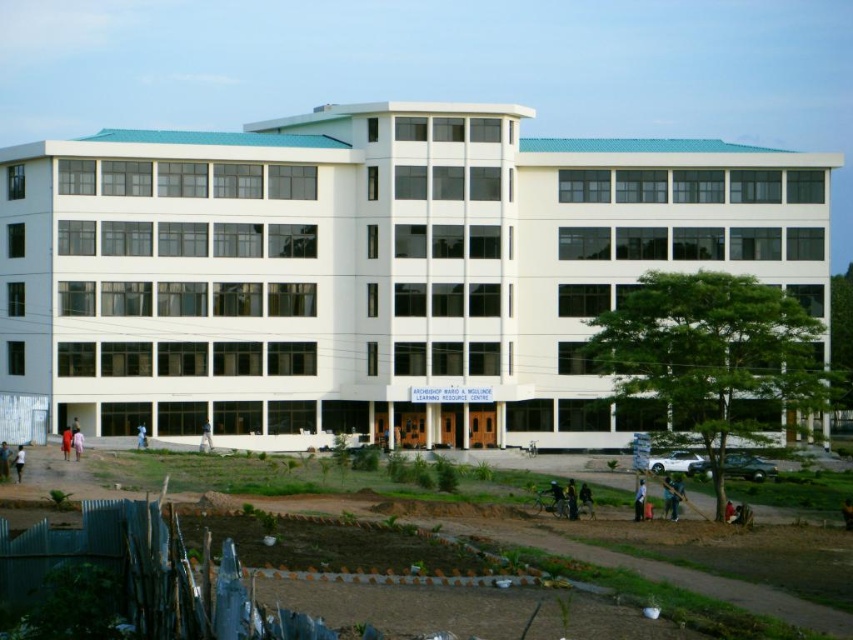
Can you confirm if dark blue fabric at lower right is smaller than light brown wooden stick at lower left?

Yes, dark blue fabric at lower right is smaller than light brown wooden stick at lower left.

Between point (566, 492) and point (0, 451), which one is positioned in front?

Positioned in front is point (566, 492).

The image size is (853, 640). Identify the location of dark blue fabric at lower right. (570, 499).

Does white cotton pants at lower center have a greater height compared to dark skin person at lower left?

No, white cotton pants at lower center is not taller than dark skin person at lower left.

Identify the location of white cotton pants at lower center. This screenshot has width=853, height=640. (206, 436).

Does black fabric person at lower right have a greater width compared to red fabric dress at lower left?

No, black fabric person at lower right is not wider than red fabric dress at lower left.

Locate an element on the screen. black fabric person at lower right is located at coordinates tap(639, 499).

Where is `black fabric person at lower right`? black fabric person at lower right is located at coordinates (639, 499).